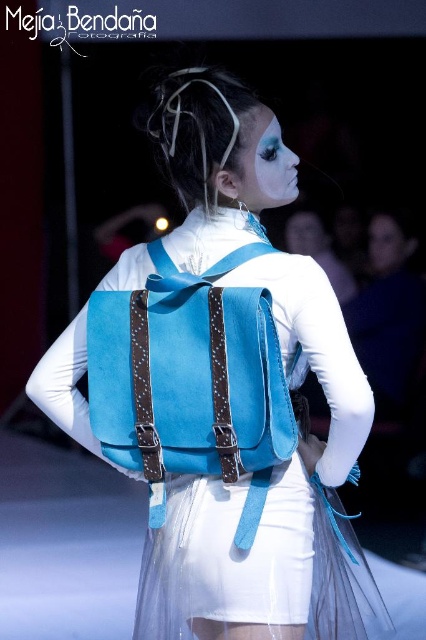
Question: Which object is closer to the camera taking this photo?

Choices:
 (A) suede/leather strap at back
 (B) matte white face at center

Answer: (A)

Question: Can you confirm if suede/leather strap at back is positioned above matte white face at center?

Choices:
 (A) yes
 (B) no

Answer: (B)

Question: Is suede/leather strap at back smaller than matte white face at center?

Choices:
 (A) no
 (B) yes

Answer: (A)

Question: Where is suede/leather strap at back located in relation to matte white face at center in the image?

Choices:
 (A) above
 (B) below

Answer: (B)